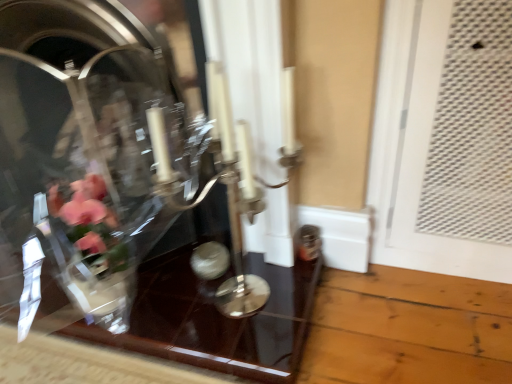
Question: In terms of size, does silver metallic candle holder at center appear bigger or smaller than clear glass vase at center?

Choices:
 (A) big
 (B) small

Answer: (B)

Question: Is silver metallic candle holder at center situated inside clear glass vase at center or outside?

Choices:
 (A) outside
 (B) inside

Answer: (A)

Question: Which object is positioned farthest from the transparent glass table at center?

Choices:
 (A) clear glass vase at center
 (B) silver metallic candle holder at center

Answer: (B)

Question: Which object is positioned farthest from the silver metallic candle holder at center?

Choices:
 (A) clear glass vase at center
 (B) transparent glass table at center

Answer: (B)